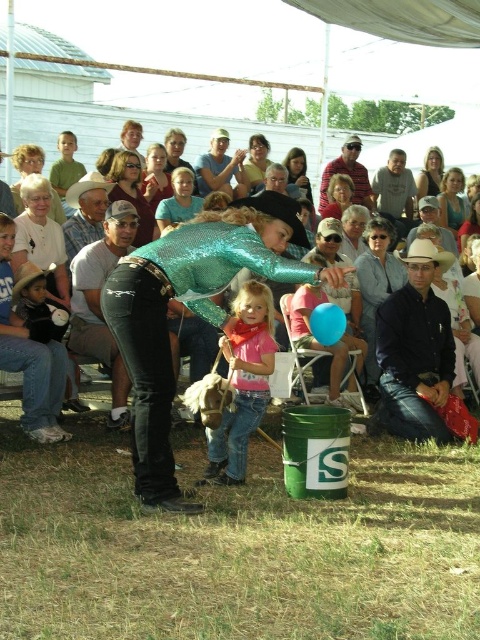
Is black leather jacket at center taller than matte black shirt at upper center?

Correct, black leather jacket at center is much taller as matte black shirt at upper center.

Who is more forward, (80,269) or (291,179)?

Point (80,269) is in front.

Where is `black leather jacket at center`? black leather jacket at center is located at coordinates (99, 304).

Who is lower down, matte gray shirt at upper center or matte blue shirt at upper right?

matte blue shirt at upper right

Is point (400, 221) less distant than point (456, 176)?

Yes, point (400, 221) is in front of point (456, 176).

In order to click on matte gray shirt at upper center in this screenshot , I will do `click(395, 192)`.

Is striped cotton shirt at center bigger than matte black shirt at upper center?

Yes, striped cotton shirt at center is bigger than matte black shirt at upper center.

Which is behind, point (356, 170) or point (311, 188)?

Point (311, 188)

Is point (361, 168) positioned behind point (288, 168)?

Yes, it is behind point (288, 168).

Find the location of a particular element. Image resolution: width=480 pixels, height=640 pixels. striped cotton shirt at center is located at coordinates (347, 173).